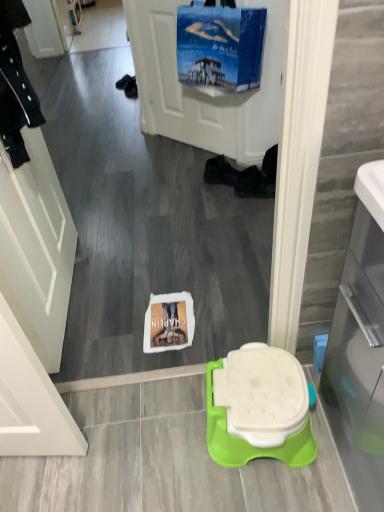
Question: Is black fabric shoe at center, which is counted as the second footwear, starting from the left, bigger than white plastic toilet at center?

Choices:
 (A) yes
 (B) no

Answer: (B)

Question: Considering the relative sizes of black fabric shoe at center, which is counted as the second footwear, starting from the left, and white plastic toilet at center in the image provided, is black fabric shoe at center, which is counted as the second footwear, starting from the left, smaller than white plastic toilet at center?

Choices:
 (A) no
 (B) yes

Answer: (B)

Question: Considering the relative sizes of black fabric shoe at center, acting as the first footwear starting from the right, and white plastic toilet at center in the image provided, is black fabric shoe at center, acting as the first footwear starting from the right, taller than white plastic toilet at center?

Choices:
 (A) yes
 (B) no

Answer: (B)

Question: Is black fabric shoe at center, which is counted as the second footwear, starting from the left, wider than white plastic toilet at center?

Choices:
 (A) no
 (B) yes

Answer: (A)

Question: Does black fabric shoe at center, acting as the first footwear starting from the right, come behind white plastic toilet at center?

Choices:
 (A) no
 (B) yes

Answer: (B)

Question: Would you say black fabric shoe at center, the first footwear viewed from the left, is to the left or to the right of white matte screen door at left, the 2th screen door when ordered from back to front, in the picture?

Choices:
 (A) left
 (B) right

Answer: (B)

Question: Based on their sizes in the image, would you say black fabric shoe at center, which is the second footwear from right to left, is bigger or smaller than white matte screen door at left, the 2th screen door when ordered from back to front?

Choices:
 (A) big
 (B) small

Answer: (B)

Question: In terms of width, does black fabric shoe at center, which is the second footwear from right to left, look wider or thinner when compared to white matte screen door at left, arranged as the 1th screen door when ordered from the bottom?

Choices:
 (A) wide
 (B) thin

Answer: (A)

Question: From a real-world perspective, relative to white matte screen door at left, arranged as the first screen door when viewed from the front, is black fabric shoe at center, the first footwear viewed from the left, vertically above or below?

Choices:
 (A) above
 (B) below

Answer: (B)

Question: Considering the positions of transparent glass door at right and black fabric shoe at center, the first footwear viewed from the left, in the image, is transparent glass door at right bigger or smaller than black fabric shoe at center, the first footwear viewed from the left,?

Choices:
 (A) small
 (B) big

Answer: (B)

Question: Based on their positions, is transparent glass door at right located to the left or right of black fabric shoe at center, which is the second footwear from right to left?

Choices:
 (A) right
 (B) left

Answer: (A)

Question: In the image, is transparent glass door at right positioned in front of or behind black fabric shoe at center, which is the second footwear from right to left?

Choices:
 (A) front
 (B) behind

Answer: (A)

Question: From their relative heights in the image, would you say transparent glass door at right is taller or shorter than black fabric shoe at center, which is the second footwear from right to left?

Choices:
 (A) tall
 (B) short

Answer: (A)

Question: Is blue fabric screen door at upper center, which is the second screen door in front-to-back order, to the left or to the right of transparent glass door at right in the image?

Choices:
 (A) left
 (B) right

Answer: (A)

Question: In the image, is blue fabric screen door at upper center, the first screen door from the top, positioned in front of or behind transparent glass door at right?

Choices:
 (A) front
 (B) behind

Answer: (B)